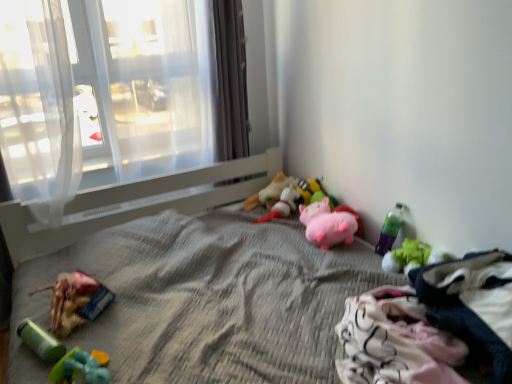
Question: Is satin gray curtain at center, the first curtain in the right-to-left sequence, far away from translucent fabric at upper left?

Choices:
 (A) yes
 (B) no

Answer: (B)

Question: From the image's perspective, is satin gray curtain at center, which appears as the 2th curtain when viewed from the left, located above translucent fabric at upper left?

Choices:
 (A) yes
 (B) no

Answer: (B)

Question: Does satin gray curtain at center, which appears as the 2th curtain when viewed from the left, have a larger size compared to translucent fabric at upper left?

Choices:
 (A) yes
 (B) no

Answer: (B)

Question: Is satin gray curtain at center, which appears as the 2th curtain when viewed from the left, in contact with translucent fabric at upper left?

Choices:
 (A) no
 (B) yes

Answer: (A)

Question: Does satin gray curtain at center, which appears as the 2th curtain when viewed from the left, have a greater height compared to translucent fabric at upper left?

Choices:
 (A) no
 (B) yes

Answer: (B)

Question: Is translucent fabric at upper left a part of satin gray curtain at center, the first curtain in the right-to-left sequence?

Choices:
 (A) no
 (B) yes

Answer: (A)

Question: From the image's perspective, is green plastic toy at lower left, positioned as the 8th toy in right-to-left order, located beneath green plush toy at lower right, the 8th toy viewed from the left?

Choices:
 (A) yes
 (B) no

Answer: (A)

Question: Is green plastic toy at lower left, which ranks as the 1th toy in left-to-right order, at the right side of green plush toy at lower right, the first toy in the right-to-left sequence?

Choices:
 (A) yes
 (B) no

Answer: (B)

Question: Considering the relative positions of green plastic toy at lower left, positioned as the 8th toy in right-to-left order, and green plush toy at lower right, the 8th toy viewed from the left, in the image provided, is green plastic toy at lower left, positioned as the 8th toy in right-to-left order, to the left of green plush toy at lower right, the 8th toy viewed from the left, from the viewer's perspective?

Choices:
 (A) no
 (B) yes

Answer: (B)

Question: Is green plastic toy at lower left, which ranks as the 1th toy in left-to-right order, looking in the opposite direction of green plush toy at lower right, the 8th toy viewed from the left?

Choices:
 (A) yes
 (B) no

Answer: (B)

Question: Does green plastic toy at lower left, positioned as the 8th toy in right-to-left order, have a greater height compared to green plush toy at lower right, the 8th toy viewed from the left?

Choices:
 (A) yes
 (B) no

Answer: (B)

Question: Can green plush toy at lower right, the first toy in the right-to-left sequence, be found inside green plastic toy at lower left, positioned as the 8th toy in right-to-left order?

Choices:
 (A) yes
 (B) no

Answer: (B)

Question: Can you see soft plush toy at center, acting as the 4th toy starting from the right, touching green plastic bottle at lower right, the 2th toy positioned from the right?

Choices:
 (A) no
 (B) yes

Answer: (A)